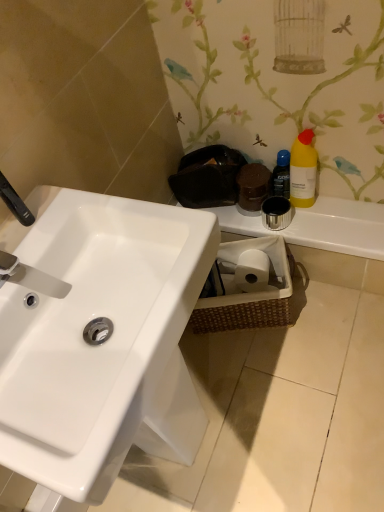
Question: Is brushed metal tap at upper left, the first plumbing fixture in the top-to-bottom sequence, looking in the opposite direction of matte silver faucet at left, the 1th plumbing fixture when ordered from bottom to top?

Choices:
 (A) no
 (B) yes

Answer: (A)

Question: Considering the relative positions of brushed metal tap at upper left, which ranks as the 2th plumbing fixture in bottom-to-top order, and matte silver faucet at left, the 1th plumbing fixture when ordered from bottom to top, in the image provided, is brushed metal tap at upper left, which ranks as the 2th plumbing fixture in bottom-to-top order, to the right of matte silver faucet at left, the 1th plumbing fixture when ordered from bottom to top, from the viewer's perspective?

Choices:
 (A) yes
 (B) no

Answer: (B)

Question: Considering the relative sizes of brushed metal tap at upper left, the first plumbing fixture in the top-to-bottom sequence, and matte silver faucet at left, placed as the 2th plumbing fixture when sorted from top to bottom, in the image provided, is brushed metal tap at upper left, the first plumbing fixture in the top-to-bottom sequence, smaller than matte silver faucet at left, placed as the 2th plumbing fixture when sorted from top to bottom,?

Choices:
 (A) yes
 (B) no

Answer: (A)

Question: Is brushed metal tap at upper left, the first plumbing fixture in the top-to-bottom sequence, aimed at matte silver faucet at left, the 1th plumbing fixture when ordered from bottom to top?

Choices:
 (A) yes
 (B) no

Answer: (B)

Question: Can you see brushed metal tap at upper left, which ranks as the 2th plumbing fixture in bottom-to-top order, touching matte silver faucet at left, placed as the 2th plumbing fixture when sorted from top to bottom?

Choices:
 (A) yes
 (B) no

Answer: (B)

Question: From a real-world perspective, does brushed metal tap at upper left, which ranks as the 2th plumbing fixture in bottom-to-top order, sit lower than matte silver faucet at left, placed as the 2th plumbing fixture when sorted from top to bottom?

Choices:
 (A) no
 (B) yes

Answer: (A)

Question: Is woven brown basket at lower right completely or partially outside of yellow matte bottle at upper right?

Choices:
 (A) no
 (B) yes

Answer: (B)

Question: Can you confirm if woven brown basket at lower right is shorter than yellow matte bottle at upper right?

Choices:
 (A) no
 (B) yes

Answer: (B)

Question: Can you confirm if woven brown basket at lower right is positioned to the right of yellow matte bottle at upper right?

Choices:
 (A) yes
 (B) no

Answer: (B)

Question: Does woven brown basket at lower right have a greater height compared to yellow matte bottle at upper right?

Choices:
 (A) yes
 (B) no

Answer: (B)

Question: From a real-world perspective, is woven brown basket at lower right located higher than yellow matte bottle at upper right?

Choices:
 (A) no
 (B) yes

Answer: (A)

Question: From the image's perspective, is woven brown basket at lower right located above yellow matte bottle at upper right?

Choices:
 (A) yes
 (B) no

Answer: (B)

Question: From the image's perspective, is matte silver faucet at left, the 1th plumbing fixture when ordered from bottom to top, on woven brown basket at lower right?

Choices:
 (A) no
 (B) yes

Answer: (B)